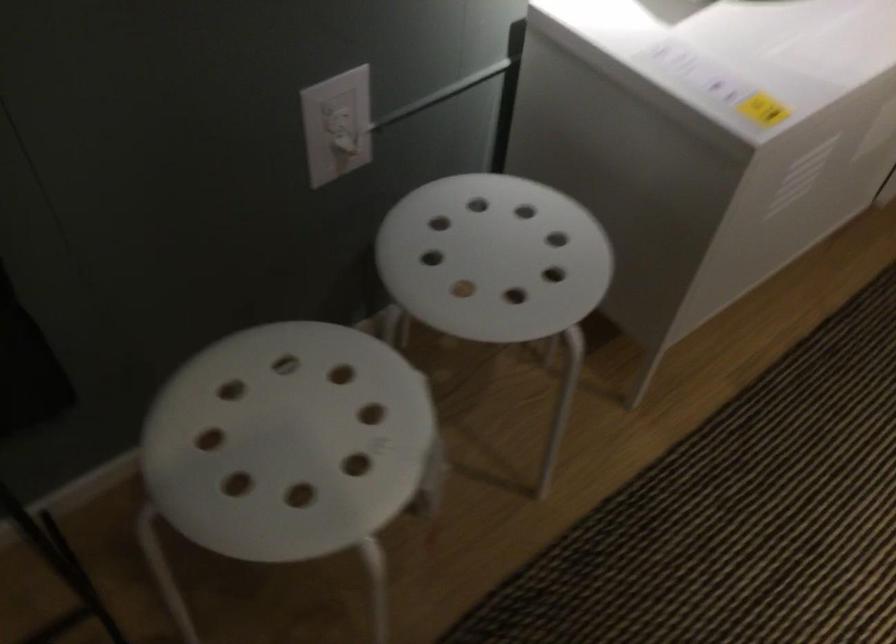
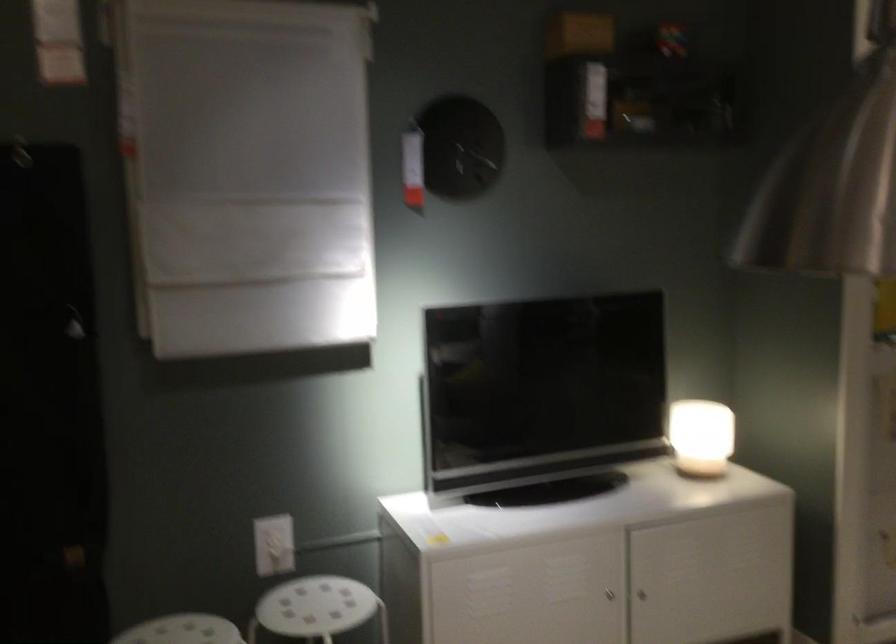
Where in the second image is the point corresponding to the point at 488,250 from the first image?

(315, 607)